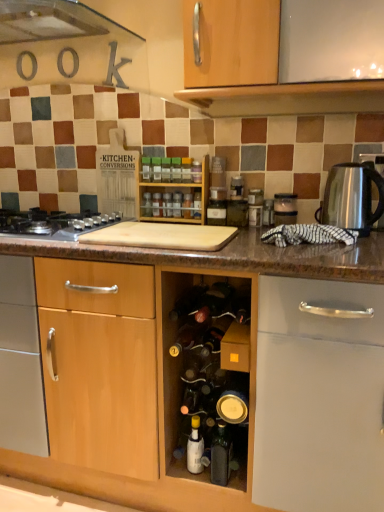
Question: Considering the positions of translucent glass spice at center, acting as the 5th bottle starting from the bottom, and wooden spice rack at center in the image, is translucent glass spice at center, acting as the 5th bottle starting from the bottom, wider or thinner than wooden spice rack at center?

Choices:
 (A) thin
 (B) wide

Answer: (A)

Question: From the image's perspective, is translucent glass spice at center, acting as the 5th bottle starting from the bottom, positioned above or below wooden spice rack at center?

Choices:
 (A) above
 (B) below

Answer: (B)

Question: Estimate the real-world distances between objects in this image. Which object is closer to the green plastic spice at center, arranged as the 10th bottle when ordered from the bottom?

Choices:
 (A) white glossy bottle at center, marked as the tenth bottle in a top-to-bottom arrangement
 (B) translucent glass spice at center, which is counted as the 8th bottle, starting from the top
 (C) matte black bottle at center, which is counted as the 11th bottle, starting from the top
 (D) silver metallic gas stove at left
 (E) translucent plastic spice at center, the 11th bottle from the bottom

Answer: (E)

Question: Based on their relative distances, which object is farther from the translucent glass spice at center, which ranks as the ninth bottle in top-to-bottom order?

Choices:
 (A) satin silver toaster at upper right
 (B) translucent glass spice at center, acting as the 5th bottle starting from the bottom
 (C) silver metallic gas stove at left
 (D) translucent plastic spice at center, the 11th bottle from the bottom
 (E) translucent plastic spice jar at center, the fourth bottle positioned from the top

Answer: (C)